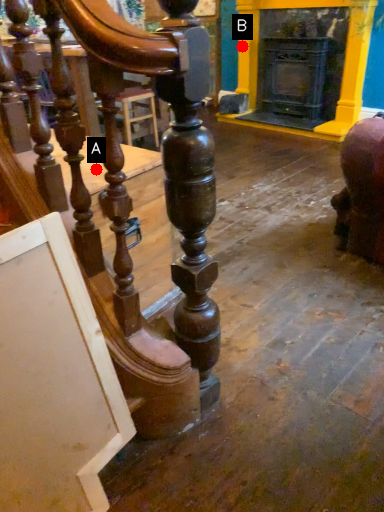
Question: Two points are circled on the image, labeled by A and B beside each circle. Which point is closer to the camera?

Choices:
 (A) A is closer
 (B) B is closer

Answer: (A)